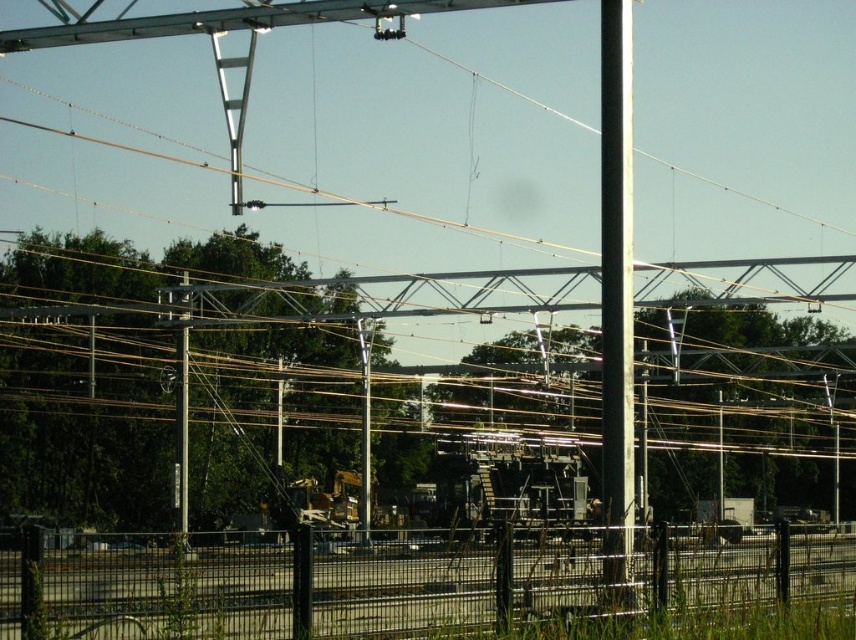
Is black wire mesh fence at lower center above white glossy pole at center?

Incorrect, black wire mesh fence at lower center is not positioned above white glossy pole at center.

Does black wire mesh fence at lower center appear on the right side of white glossy pole at center?

No, black wire mesh fence at lower center is not to the right of white glossy pole at center.

Which is behind, point (450, 618) or point (629, 152)?

The point (629, 152) is behind.

I want to click on black wire mesh fence at lower center, so click(x=413, y=582).

Can you confirm if black wire mesh fence at lower center is positioned to the left of metallic gray pole at left?

Incorrect, black wire mesh fence at lower center is not on the left side of metallic gray pole at left.

Is point (530, 604) closer to viewer compared to point (183, 424)?

Yes, point (530, 604) is in front of point (183, 424).

Which is in front, point (325, 620) or point (183, 480)?

Point (325, 620) is more forward.

At what (x,y) coordinates should I click in order to perform the action: click on black wire mesh fence at lower center. Please return your answer as a coordinate pair (x, y). Image resolution: width=856 pixels, height=640 pixels. Looking at the image, I should click on (413, 582).

Between metallic gray pole at left and metallic gray pole at center, which one has less height?

metallic gray pole at center

Which is below, metallic gray pole at left or metallic gray pole at center?

Positioned lower is metallic gray pole at center.

Is point (183, 404) in front of point (367, 378)?

Yes, it is in front of point (367, 378).

The image size is (856, 640). Identify the location of metallic gray pole at left. (182, 435).